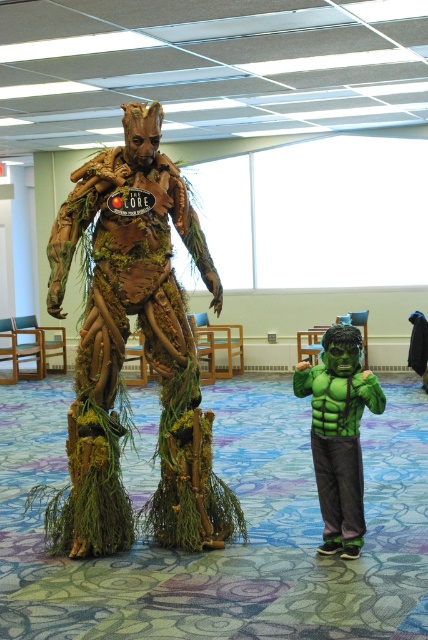
Question: Which point is closer to the camera taking this photo?

Choices:
 (A) (350, 371)
 (B) (116, 456)

Answer: (A)

Question: In this image, where is wooden textured tree-like figure at center located relative to green matte hulk costume at lower right?

Choices:
 (A) above
 (B) below

Answer: (A)

Question: Is wooden textured tree-like figure at center closer to the viewer compared to green matte hulk costume at lower right?

Choices:
 (A) no
 (B) yes

Answer: (B)

Question: Among these objects, which one is nearest to the camera?

Choices:
 (A) green matte hulk costume at lower right
 (B) wooden textured tree-like figure at center

Answer: (B)

Question: Can you confirm if wooden textured tree-like figure at center is positioned to the right of green matte hulk costume at lower right?

Choices:
 (A) no
 (B) yes

Answer: (A)